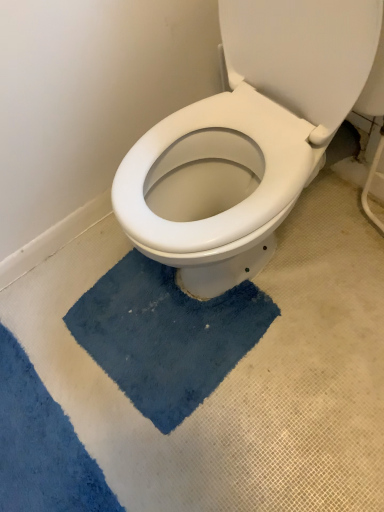
Image resolution: width=384 pixels, height=512 pixels. What do you see at coordinates (41, 445) in the screenshot?
I see `blue plush bath mat at lower center, marked as the 2th bath mat in a right-to-left arrangement` at bounding box center [41, 445].

You are a GUI agent. You are given a task and a screenshot of the screen. Output one action in this format:
    pyautogui.click(x=<x>, y=<y>)
    Task: Click on the blue plush bath mat at lower center, the first bath mat in the left-to-right sequence
    The height and width of the screenshot is (512, 384).
    Given the screenshot: What is the action you would take?
    pyautogui.click(x=41, y=445)

Where is `blue plush bath mat at center, acting as the first bath mat starting from the right`? blue plush bath mat at center, acting as the first bath mat starting from the right is located at coordinates (166, 335).

What is the approximate height of blue plush bath mat at center, acting as the first bath mat starting from the right?

The height of blue plush bath mat at center, acting as the first bath mat starting from the right, is 1.68 inches.

What do you see at coordinates (166, 335) in the screenshot? The image size is (384, 512). I see `blue plush bath mat at center, acting as the first bath mat starting from the right` at bounding box center [166, 335].

Where is `blue plush bath mat at lower center, marked as the 2th bath mat in a right-to-left arrangement`? The height and width of the screenshot is (512, 384). blue plush bath mat at lower center, marked as the 2th bath mat in a right-to-left arrangement is located at coordinates (41, 445).

Can you confirm if blue plush bath mat at lower center, the first bath mat in the left-to-right sequence, is positioned to the left of blue plush bath mat at center, acting as the first bath mat starting from the right?

Correct, you'll find blue plush bath mat at lower center, the first bath mat in the left-to-right sequence, to the left of blue plush bath mat at center, acting as the first bath mat starting from the right.

Based on the photo, is blue plush bath mat at lower center, marked as the 2th bath mat in a right-to-left arrangement, closer to camera compared to blue plush bath mat at center, which is the second bath mat in left-to-right order?

Yes, it is.

Is point (26, 501) less distant than point (174, 353)?

Yes, point (26, 501) is closer to viewer.

Looking at this image, from the image's perspective, between blue plush bath mat at lower center, the first bath mat in the left-to-right sequence, and blue plush bath mat at center, acting as the first bath mat starting from the right, which one is located above?

blue plush bath mat at center, acting as the first bath mat starting from the right, is shown above in the image.

From a real-world perspective, between blue plush bath mat at lower center, the first bath mat in the left-to-right sequence, and blue plush bath mat at center, acting as the first bath mat starting from the right, who is vertically higher?

blue plush bath mat at lower center, the first bath mat in the left-to-right sequence, is physically above.

Does blue plush bath mat at lower center, marked as the 2th bath mat in a right-to-left arrangement, have a lesser width compared to blue plush bath mat at center, which is the second bath mat in left-to-right order?

Yes, blue plush bath mat at lower center, marked as the 2th bath mat in a right-to-left arrangement, is thinner than blue plush bath mat at center, which is the second bath mat in left-to-right order.

Considering the sizes of objects blue plush bath mat at lower center, marked as the 2th bath mat in a right-to-left arrangement, and blue plush bath mat at center, which is the second bath mat in left-to-right order, in the image provided, who is taller, blue plush bath mat at lower center, marked as the 2th bath mat in a right-to-left arrangement, or blue plush bath mat at center, which is the second bath mat in left-to-right order,?

With more height is blue plush bath mat at center, which is the second bath mat in left-to-right order.

Considering the sizes of objects blue plush bath mat at lower center, marked as the 2th bath mat in a right-to-left arrangement, and blue plush bath mat at center, which is the second bath mat in left-to-right order, in the image provided, who is bigger, blue plush bath mat at lower center, marked as the 2th bath mat in a right-to-left arrangement, or blue plush bath mat at center, which is the second bath mat in left-to-right order,?

blue plush bath mat at center, which is the second bath mat in left-to-right order.

Is blue plush bath mat at center, acting as the first bath mat starting from the right, surrounded by blue plush bath mat at lower center, the first bath mat in the left-to-right sequence?

That's incorrect, blue plush bath mat at center, acting as the first bath mat starting from the right, is not inside blue plush bath mat at lower center, the first bath mat in the left-to-right sequence.

In the scene shown: Is blue plush bath mat at lower center, the first bath mat in the left-to-right sequence, far away from blue plush bath mat at center, which is the second bath mat in left-to-right order?

No, blue plush bath mat at lower center, the first bath mat in the left-to-right sequence, is in close proximity to blue plush bath mat at center, which is the second bath mat in left-to-right order.

Is blue plush bath mat at lower center, the first bath mat in the left-to-right sequence, positioned with its back to blue plush bath mat at center, which is the second bath mat in left-to-right order?

Yes, blue plush bath mat at lower center, the first bath mat in the left-to-right sequence,'s orientation is away from blue plush bath mat at center, which is the second bath mat in left-to-right order.

How many degrees apart are the facing directions of blue plush bath mat at lower center, marked as the 2th bath mat in a right-to-left arrangement, and blue plush bath mat at center, which is the second bath mat in left-to-right order?

The facing directions of blue plush bath mat at lower center, marked as the 2th bath mat in a right-to-left arrangement, and blue plush bath mat at center, which is the second bath mat in left-to-right order, are 7.64 degrees apart.

Consider the image. How much distance is there between blue plush bath mat at lower center, the first bath mat in the left-to-right sequence, and blue plush bath mat at center, which is the second bath mat in left-to-right order?

blue plush bath mat at lower center, the first bath mat in the left-to-right sequence, is 11.45 inches away from blue plush bath mat at center, which is the second bath mat in left-to-right order.

The width and height of the screenshot is (384, 512). There is a blue plush bath mat at center, which is the second bath mat in left-to-right order. Find the location of `bath mat above it (from a real-world perspective)`. bath mat above it (from a real-world perspective) is located at coordinates (41, 445).

Considering the positions of objects blue plush bath mat at center, acting as the first bath mat starting from the right, and blue plush bath mat at lower center, the first bath mat in the left-to-right sequence, in the image provided, who is more to the left, blue plush bath mat at center, acting as the first bath mat starting from the right, or blue plush bath mat at lower center, the first bath mat in the left-to-right sequence,?

blue plush bath mat at lower center, the first bath mat in the left-to-right sequence, is more to the left.

Between blue plush bath mat at center, which is the second bath mat in left-to-right order, and blue plush bath mat at lower center, the first bath mat in the left-to-right sequence, which one is positioned behind?

blue plush bath mat at center, which is the second bath mat in left-to-right order.

Does point (238, 308) appear closer or farther from the camera than point (46, 458)?

Point (238, 308).

From the image's perspective, does blue plush bath mat at center, which is the second bath mat in left-to-right order, appear lower than blue plush bath mat at lower center, marked as the 2th bath mat in a right-to-left arrangement?

No.

From a real-world perspective, is blue plush bath mat at center, which is the second bath mat in left-to-right order, on top of blue plush bath mat at lower center, marked as the 2th bath mat in a right-to-left arrangement?

No, from a real-world perspective, blue plush bath mat at center, which is the second bath mat in left-to-right order, is not over blue plush bath mat at lower center, marked as the 2th bath mat in a right-to-left arrangement

Can you confirm if blue plush bath mat at center, acting as the first bath mat starting from the right, is thinner than blue plush bath mat at lower center, marked as the 2th bath mat in a right-to-left arrangement?

No, blue plush bath mat at center, acting as the first bath mat starting from the right, is not thinner than blue plush bath mat at lower center, marked as the 2th bath mat in a right-to-left arrangement.

Based on the photo, considering the relative sizes of blue plush bath mat at center, acting as the first bath mat starting from the right, and blue plush bath mat at lower center, marked as the 2th bath mat in a right-to-left arrangement, in the image provided, is blue plush bath mat at center, acting as the first bath mat starting from the right, shorter than blue plush bath mat at lower center, marked as the 2th bath mat in a right-to-left arrangement,?

No.

Based on their sizes in the image, would you say blue plush bath mat at center, acting as the first bath mat starting from the right, is bigger or smaller than blue plush bath mat at lower center, the first bath mat in the left-to-right sequence?

Clearly, blue plush bath mat at center, acting as the first bath mat starting from the right, is larger in size than blue plush bath mat at lower center, the first bath mat in the left-to-right sequence.

Would you say blue plush bath mat at center, which is the second bath mat in left-to-right order, is outside blue plush bath mat at lower center, the first bath mat in the left-to-right sequence?

That's correct, blue plush bath mat at center, which is the second bath mat in left-to-right order, is outside of blue plush bath mat at lower center, the first bath mat in the left-to-right sequence.

Is blue plush bath mat at center, which is the second bath mat in left-to-right order, beside blue plush bath mat at lower center, the first bath mat in the left-to-right sequence?

No, blue plush bath mat at center, which is the second bath mat in left-to-right order, is not touching blue plush bath mat at lower center, the first bath mat in the left-to-right sequence.

Could you tell me if blue plush bath mat at center, acting as the first bath mat starting from the right, is turned towards blue plush bath mat at lower center, marked as the 2th bath mat in a right-to-left arrangement?

Yes, blue plush bath mat at center, acting as the first bath mat starting from the right, is turned towards blue plush bath mat at lower center, marked as the 2th bath mat in a right-to-left arrangement.

How many degrees apart are the facing directions of blue plush bath mat at center, which is the second bath mat in left-to-right order, and blue plush bath mat at lower center, marked as the 2th bath mat in a right-to-left arrangement?

The facing directions of blue plush bath mat at center, which is the second bath mat in left-to-right order, and blue plush bath mat at lower center, marked as the 2th bath mat in a right-to-left arrangement, are 7.64 degrees apart.

What are the coordinates of `bath mat behind the blue plush bath mat at lower center, marked as the 2th bath mat in a right-to-left arrangement` in the screenshot? It's located at (166, 335).

You are a GUI agent. You are given a task and a screenshot of the screen. Output one action in this format:
    pyautogui.click(x=<x>, y=<y>)
    Task: Click on the bath mat lying behind the blue plush bath mat at lower center, the first bath mat in the left-to-right sequence
    This screenshot has width=384, height=512.
    Given the screenshot: What is the action you would take?
    pyautogui.click(x=166, y=335)

Find the location of a particular element. bath mat in front of the blue plush bath mat at center, which is the second bath mat in left-to-right order is located at coordinates (41, 445).